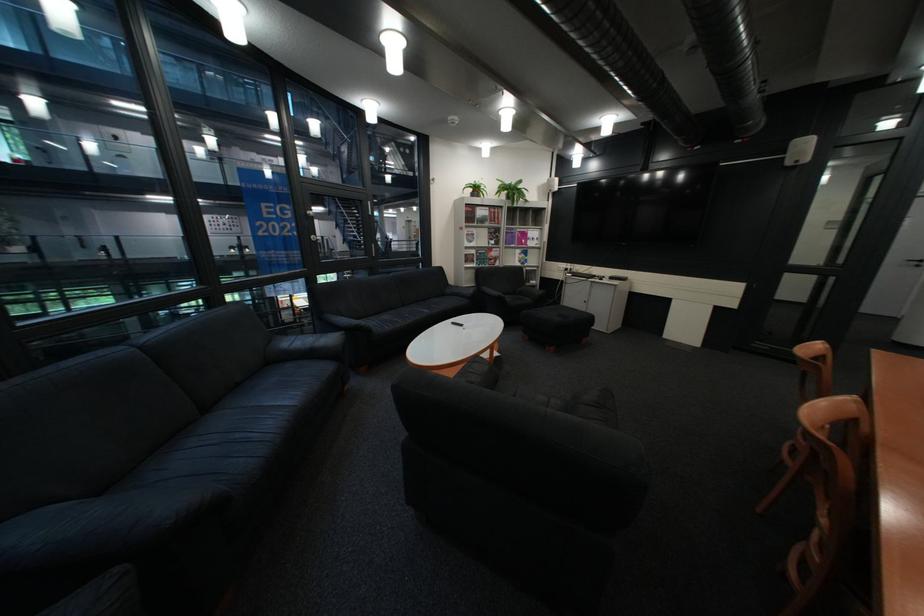
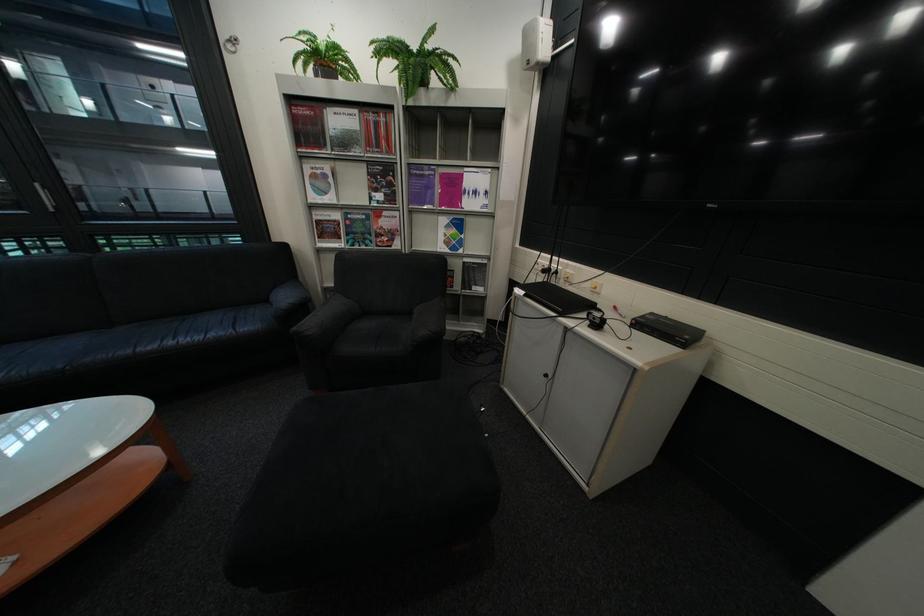
Locate, in the second image, the point that corresponds to the point at 581,270 in the first image.

(563, 270)